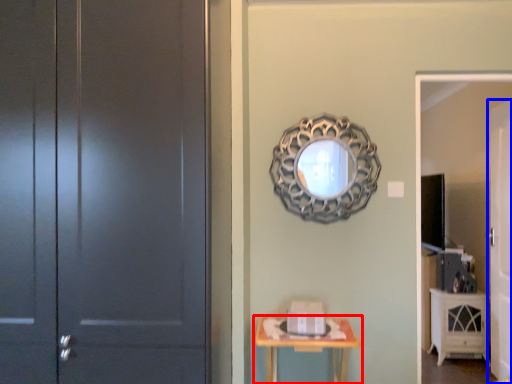
Question: Which point is further to the camera, table (highlighted by a red box) or door (highlighted by a blue box)?

Choices:
 (A) table
 (B) door

Answer: (B)